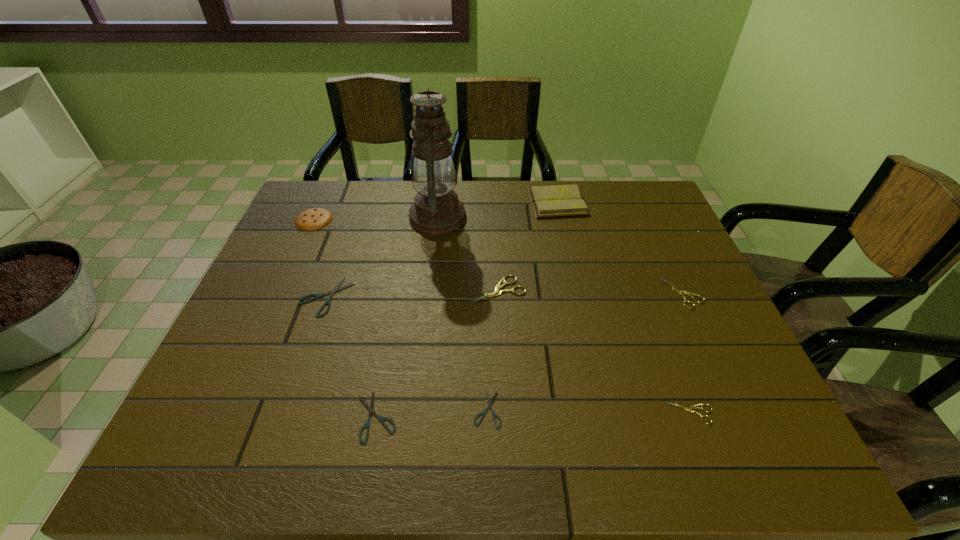
Identify the location of the tallest object. (437, 210).

The width and height of the screenshot is (960, 540). Find the location of `the eighth shortest object`. the eighth shortest object is located at coordinates (552, 201).

In order to click on diary in this screenshot , I will do `click(552, 201)`.

The width and height of the screenshot is (960, 540). Find the location of `the seventh shortest object`. the seventh shortest object is located at coordinates (312, 219).

The image size is (960, 540). I want to click on the biggest beige shears, so [497, 291].

Locate an element on the screen. the tallest shears is located at coordinates (497, 291).

Locate an element on the screen. The image size is (960, 540). the second biggest beige shears is located at coordinates (680, 292).

Locate an element on the screen. This screenshot has height=540, width=960. the rightmost shears is located at coordinates [x=680, y=292].

Locate an element on the screen. The image size is (960, 540). the biggest black shears is located at coordinates (335, 289).

Locate an element on the screen. Image resolution: width=960 pixels, height=540 pixels. the leftmost black shears is located at coordinates (335, 289).